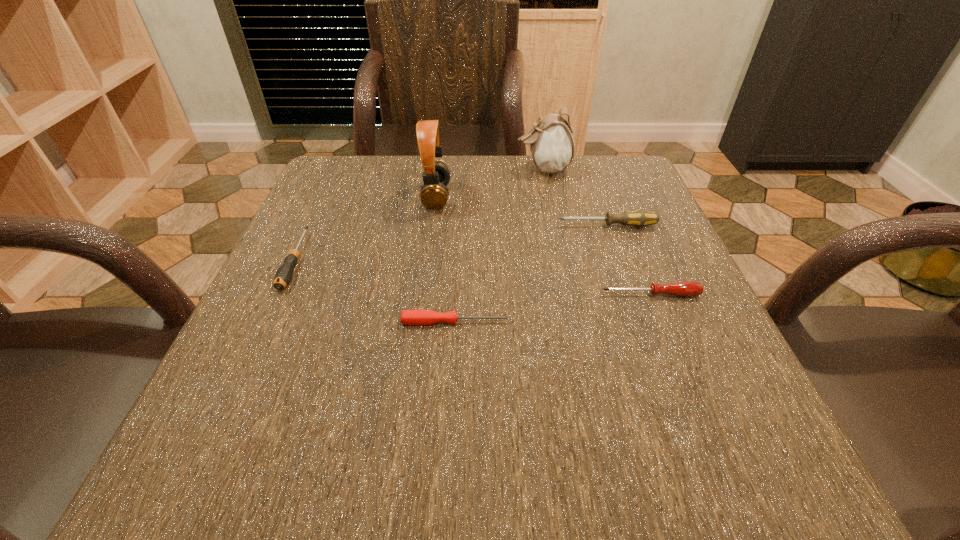
You are a GUI agent. You are given a task and a screenshot of the screen. Output one action in this format:
    pyautogui.click(x=<x>, y=<y>)
    Task: Click on the vacant area situated 0.110m on the front-facing side of the second tallest object
    This screenshot has width=960, height=540.
    Given the screenshot: What is the action you would take?
    pyautogui.click(x=471, y=169)

The width and height of the screenshot is (960, 540). What are the coordinates of `vacant region located on the front-facing side of the second tallest object` in the screenshot? It's located at (488, 169).

This screenshot has height=540, width=960. I want to click on free space located 0.110m at the tip of the third tallest object, so (x=504, y=226).

Locate an element on the screen. The image size is (960, 540). free space located 0.280m at the tip of the third tallest object is located at coordinates (421, 226).

Identify the location of free location located at the tip of the third tallest object. (407, 226).

At what (x,y) coordinates should I click in order to perform the action: click on vacant area situated 0.050m on the right of the leftmost object. Please return your answer as a coordinate pair (x, y). Image resolution: width=960 pixels, height=540 pixels. Looking at the image, I should click on (330, 260).

At what (x,y) coordinates should I click in order to perform the action: click on blank area located at the tip of the second screwdriver from left to right. Please return your answer as a coordinate pair (x, y). Looking at the image, I should click on (545, 322).

Find the location of a particular element. This screenshot has height=540, width=960. headset that is at the far edge is located at coordinates (434, 194).

Identify the location of pouch present at the far edge. The height and width of the screenshot is (540, 960). (552, 146).

Where is `object that is at the left edge`? Image resolution: width=960 pixels, height=540 pixels. object that is at the left edge is located at coordinates (283, 276).